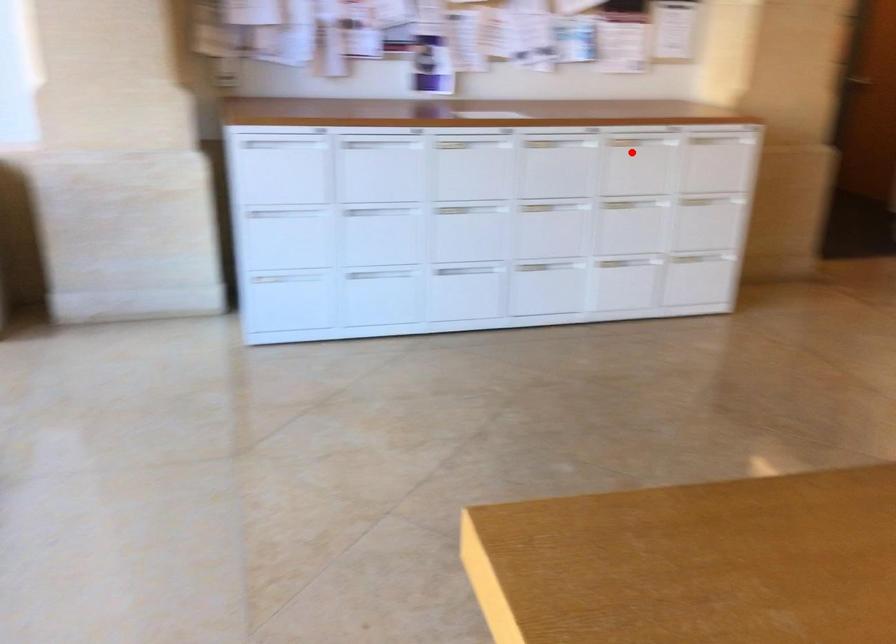
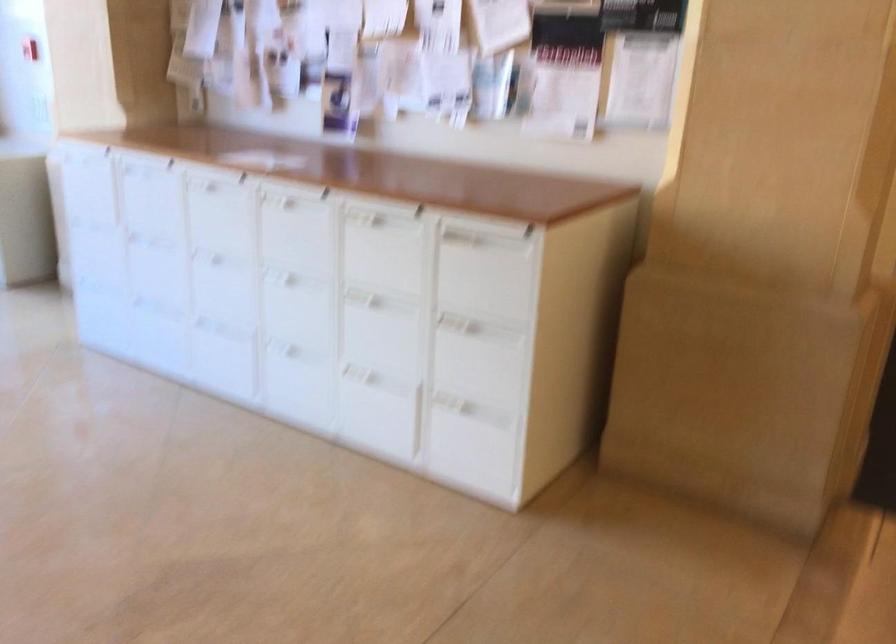
Question: A red point is marked in image1. In image2, is the corresponding 3D point closer to the camera or farther? Reply with the corresponding letter.

Choices:
 (A) The corresponding 3D point is closer.
 (B) The corresponding 3D point is farther.

Answer: (A)